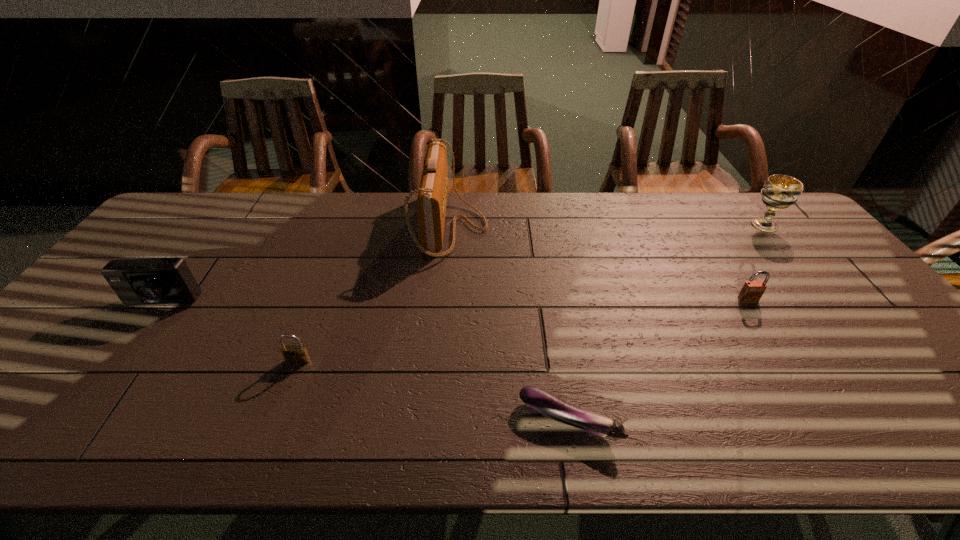
Locate an element on the screen. object at the near edge is located at coordinates (544, 402).

Find the location of a particular element. The width and height of the screenshot is (960, 540). object that is positioned at the left edge is located at coordinates (152, 281).

Locate an element on the screen. object that is positioned at the right edge is located at coordinates (779, 192).

Locate an element on the screen. object that is at the far right corner is located at coordinates (779, 192).

Identify the location of free region at the far edge. This screenshot has height=540, width=960. (754, 231).

Where is `vacant space at the near edge of the desktop`? vacant space at the near edge of the desktop is located at coordinates (354, 446).

In the image, there is a desktop. Where is `vacant space at the right edge`? This screenshot has width=960, height=540. vacant space at the right edge is located at coordinates (832, 326).

In the image, there is a desktop. At what (x,y) coordinates should I click in order to perform the action: click on free region at the far left corner. Please return your answer as a coordinate pair (x, y). The width and height of the screenshot is (960, 540). Looking at the image, I should click on (159, 229).

At what (x,y) coordinates should I click in order to perform the action: click on vacant space in between the leftmost object and the farther padlock. Please return your answer as a coordinate pair (x, y). This screenshot has height=540, width=960. Looking at the image, I should click on [x=455, y=301].

Identify the location of empty location between the handbag and the shortest object. This screenshot has height=540, width=960. (510, 323).